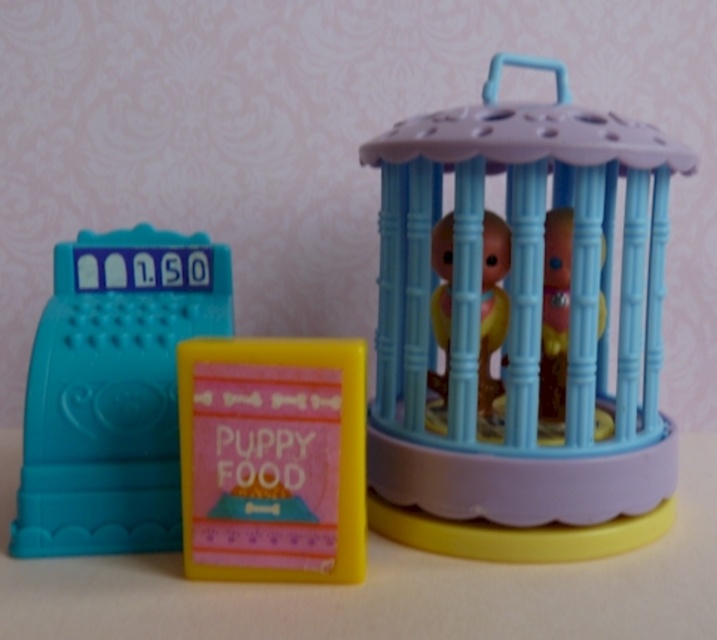
You are setting up a display for a toy store. You have the pastel blue plastic birdcage at right and the matte plastic cash register at left. Which toy takes up more space on the shelf?

The pastel blue plastic birdcage at right is larger in size than the matte plastic cash register at left, so it takes up more space on the shelf.

You are setting up a toy store display and need to arrange the pastel blue plastic birdcage at right and the matte plastic cash register at left. According to the scene, which toy is closer to the viewer?

The pastel blue plastic birdcage at right is closer to the viewer because it is in front of the matte plastic cash register at left.